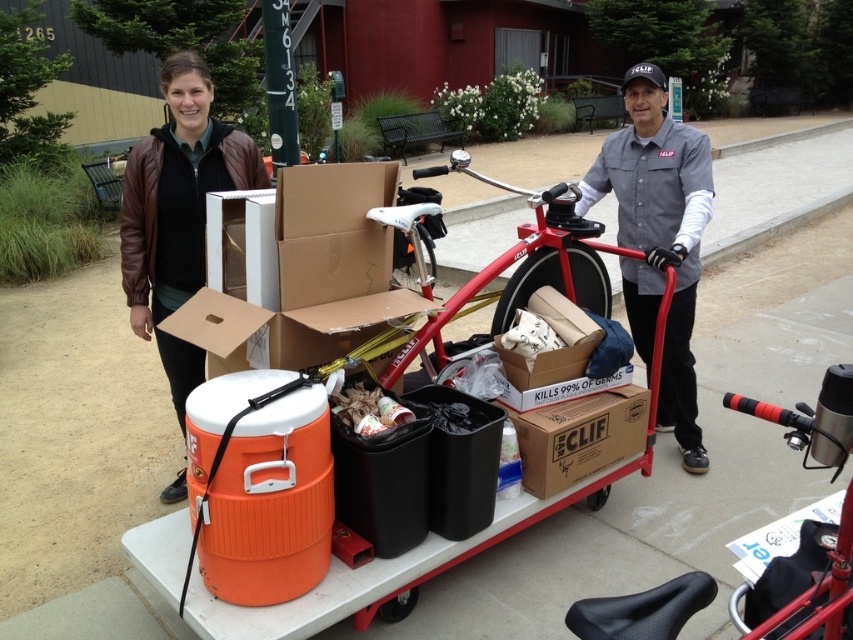
You are trying to determine which object takes up more space in the image. Based on the scene, which one is larger between the brown leather jacket at upper left and the red matte bicycle at center?

The brown leather jacket at upper left is bigger than the red matte bicycle at center according to the description.